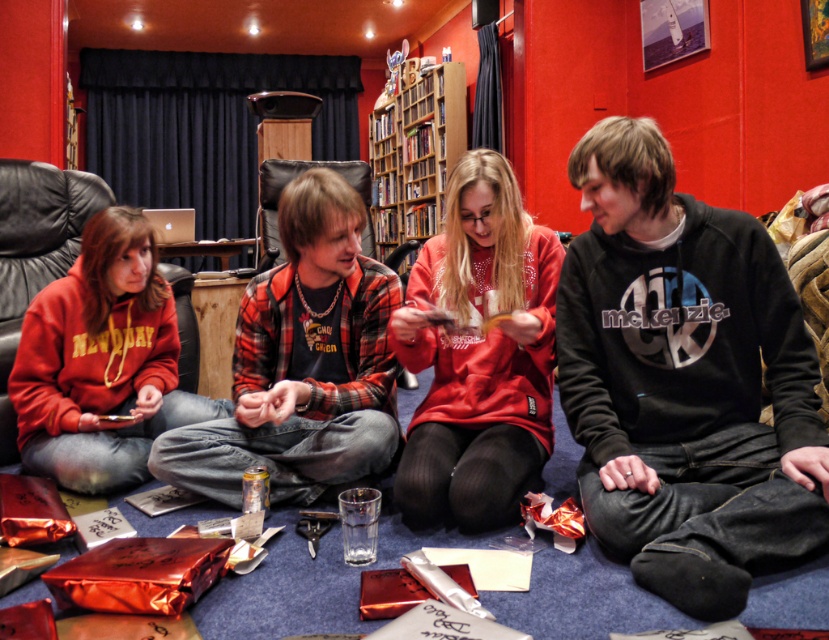
Consider the image. You are organizing a small event and need to place a large decorative item on the wooden bookshelf at upper center. The black cotton hoodie at center is currently occupying space there. Can the hoodie be moved to make room for the item?

The black cotton hoodie at center has a smaller size compared to wooden bookshelf at upper center, so it can be moved to make room for the large decorative item on the wooden bookshelf at upper center.

You are organizing a small event and need to place a large decorative item in the room. Considering the space taken by the matte red hoodie at center and the wooden bookshelf at upper center, which object would be more suitable to move to accommodate the item?

The matte red hoodie at center occupies less space than the wooden bookshelf at upper center, so moving the matte red hoodie at center would be more suitable to accommodate the large decorative item.